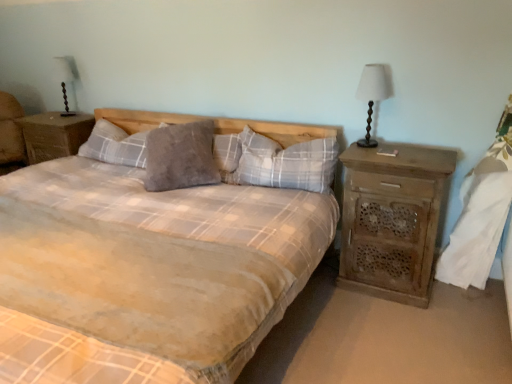
Question: Does matte wood lamp at right have a lesser width compared to white fabric at right?

Choices:
 (A) no
 (B) yes

Answer: (B)

Question: Considering the relative positions of matte wood lamp at right and white fabric at right in the image provided, is matte wood lamp at right to the right of white fabric at right from the viewer's perspective?

Choices:
 (A) yes
 (B) no

Answer: (B)

Question: Can we say matte wood lamp at right lies outside white fabric at right?

Choices:
 (A) yes
 (B) no

Answer: (A)

Question: From the image's perspective, is matte wood lamp at right located above white fabric at right?

Choices:
 (A) no
 (B) yes

Answer: (B)

Question: Can you confirm if matte wood lamp at right is shorter than white fabric at right?

Choices:
 (A) yes
 (B) no

Answer: (A)

Question: Based on their sizes in the image, would you say matte wood lamp at right is bigger or smaller than plush gray pillow at center, placed as the third pillow when sorted from right to left?

Choices:
 (A) small
 (B) big

Answer: (A)

Question: Is matte wood lamp at right wider or thinner than plush gray pillow at center, placed as the third pillow when sorted from right to left?

Choices:
 (A) thin
 (B) wide

Answer: (A)

Question: From a real-world perspective, relative to plush gray pillow at center, the first pillow when ordered from left to right, is matte wood lamp at right vertically above or below?

Choices:
 (A) below
 (B) above

Answer: (B)

Question: Is matte wood lamp at right spatially inside plush gray pillow at center, the first pillow when ordered from left to right, or outside of it?

Choices:
 (A) inside
 (B) outside

Answer: (B)

Question: Considering the positions of point (146, 183) and point (484, 192), is point (146, 183) closer or farther from the camera than point (484, 192)?

Choices:
 (A) farther
 (B) closer

Answer: (A)

Question: Visually, is grey fuzzy pillow at center, which ranks as the 2th pillow in right-to-left order, positioned to the left or to the right of white fabric at right?

Choices:
 (A) right
 (B) left

Answer: (B)

Question: Looking at their shapes, would you say grey fuzzy pillow at center, which ranks as the 2th pillow in right-to-left order, is wider or thinner than white fabric at right?

Choices:
 (A) wide
 (B) thin

Answer: (A)

Question: Is grey fuzzy pillow at center, which ranks as the 2th pillow in right-to-left order, in front of or behind white fabric at right in the image?

Choices:
 (A) front
 (B) behind

Answer: (B)

Question: Considering their positions, is rustic wood nightstand at right, the first nightstand when ordered from right to left, located in front of or behind wooden nightstand at left, acting as the 1th nightstand starting from the left?

Choices:
 (A) front
 (B) behind

Answer: (A)

Question: Based on their sizes in the image, would you say rustic wood nightstand at right, the first nightstand when ordered from right to left, is bigger or smaller than wooden nightstand at left, which is the 2th nightstand from bottom to top?

Choices:
 (A) big
 (B) small

Answer: (A)